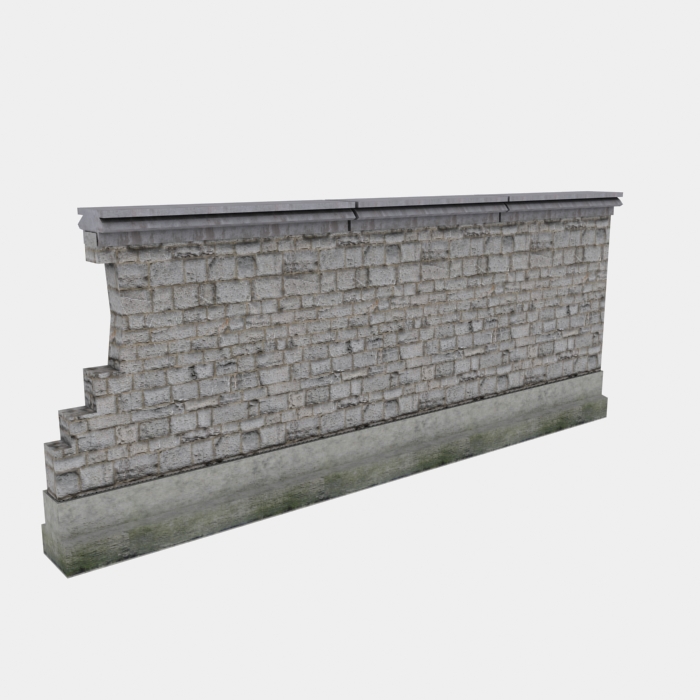
Where is `cut off wall`? This screenshot has width=700, height=700. cut off wall is located at coordinates click(x=115, y=341).